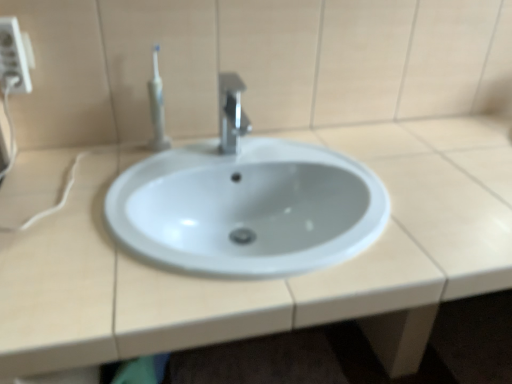
Question: In the image, is white glossy sink at center positioned in front of or behind white plastic electric outlet at upper left?

Choices:
 (A) front
 (B) behind

Answer: (A)

Question: In terms of width, does white glossy sink at center look wider or thinner when compared to white plastic electric outlet at upper left?

Choices:
 (A) wide
 (B) thin

Answer: (A)

Question: Which is farther from the white plastic toothbrush at upper left?

Choices:
 (A) white plastic electric outlet at upper left
 (B) polished metallic faucet at center
 (C) white glossy sink at center

Answer: (C)

Question: Which of these objects is positioned closest to the white plastic electric outlet at upper left?

Choices:
 (A) white plastic toothbrush at upper left
 (B) white glossy sink at center
 (C) polished metallic faucet at center

Answer: (A)